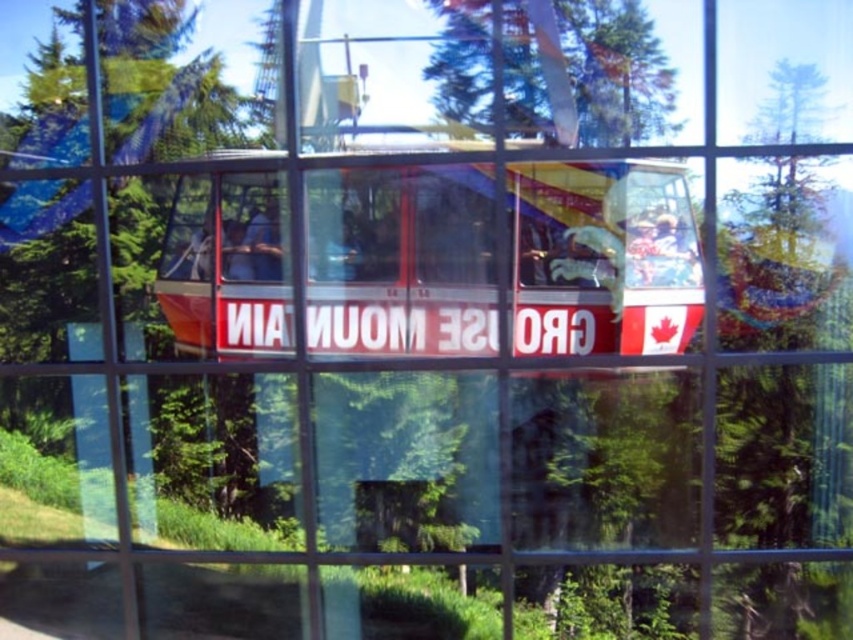
Can you confirm if translucent glass decker bus at center is positioned to the right of green leafy tree at upper center?

In fact, translucent glass decker bus at center is to the left of green leafy tree at upper center.

The width and height of the screenshot is (853, 640). Identify the location of translucent glass decker bus at center. (602, 259).

Where is `translucent glass decker bus at center`? This screenshot has height=640, width=853. translucent glass decker bus at center is located at coordinates (602, 259).